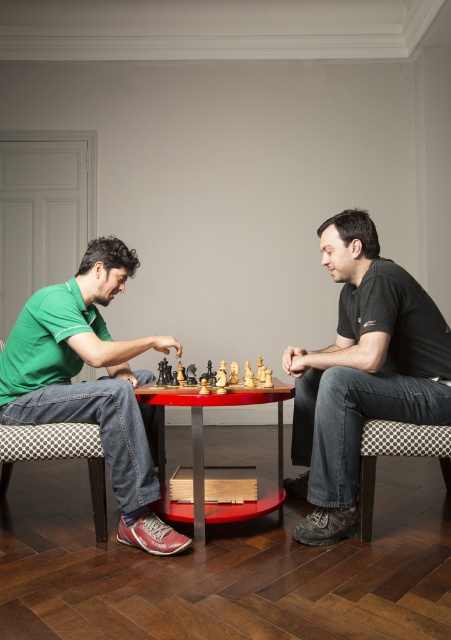
You are observing a chess game between two players. You notice a green fabric shirt at left and a wooden chess set at center. Which object is positioned to the left of the other?

The green fabric shirt at left is to the left of the wooden chess set at center.

You are a photographer trying to capture a closeup of the black cotton shirt at center without including the patterned fabric stool at lower left in the frame. Is this possible given their positions?

The black cotton shirt at center is positioned over the patterned fabric stool at lower left, so it is not possible to capture the black cotton shirt at center without including the patterned fabric stool at lower left in the frame.